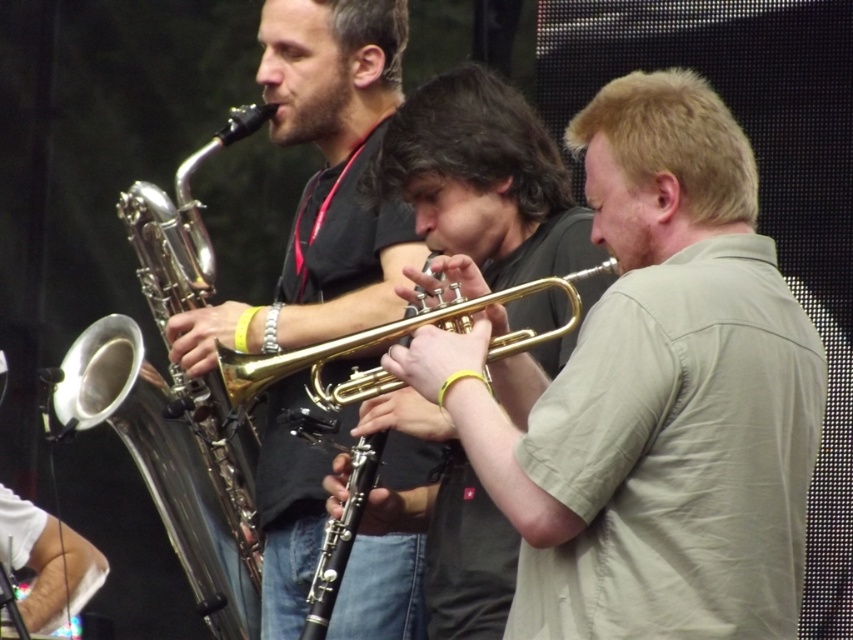
Can you confirm if shiny brass saxophone at left is positioned to the right of shiny gold trumpet at left?

Yes, shiny brass saxophone at left is to the right of shiny gold trumpet at left.

Which is behind, point (323, 140) or point (155, 392)?

The point (323, 140) is behind.

Identify the location of shiny brass saxophone at left. (322, 182).

Does shiny brass saxophone at left appear on the left side of gold shiny trumpet at center?

Correct, you'll find shiny brass saxophone at left to the left of gold shiny trumpet at center.

Does shiny brass saxophone at left lie behind gold shiny trumpet at center?

That is True.

The image size is (853, 640). Find the location of `shiny brass saxophone at left`. shiny brass saxophone at left is located at coordinates (322, 182).

You are a GUI agent. You are given a task and a screenshot of the screen. Output one action in this format:
    pyautogui.click(x=<x>, y=<y>)
    Task: Click on the shiny brass saxophone at left
    The height and width of the screenshot is (640, 853).
    Given the screenshot: What is the action you would take?
    pyautogui.click(x=322, y=182)

Between gold brass trumpet at center and shiny gold trumpet at left, which one is positioned lower?

shiny gold trumpet at left

Can you confirm if gold brass trumpet at center is positioned to the right of shiny gold trumpet at left?

Yes, gold brass trumpet at center is to the right of shiny gold trumpet at left.

What do you see at coordinates (653, 396) in the screenshot? I see `gold brass trumpet at center` at bounding box center [653, 396].

Find the location of `gold brass trumpet at center`. gold brass trumpet at center is located at coordinates (653, 396).